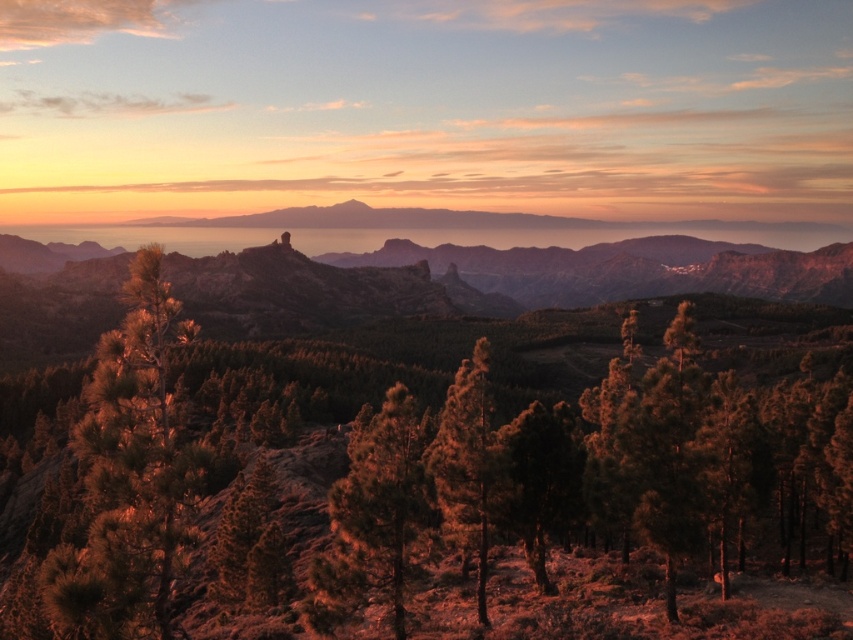
You are a hiker standing at the base of the green textured pine tree at left and want to reach the top of the green textured pine tree at center. Given that the tree at center is taller, which path would require more climbing effort?

The green textured pine tree at center is taller than the green textured pine tree at left, so reaching its top would require more climbing effort.

You are standing in the landscape and want to walk towards the green textured pine tree at center and the green textured pine tree at left. Which one will you reach first?

The green textured pine tree at center is closer to you than the green textured pine tree at left, so you will reach the green textured pine tree at center first.